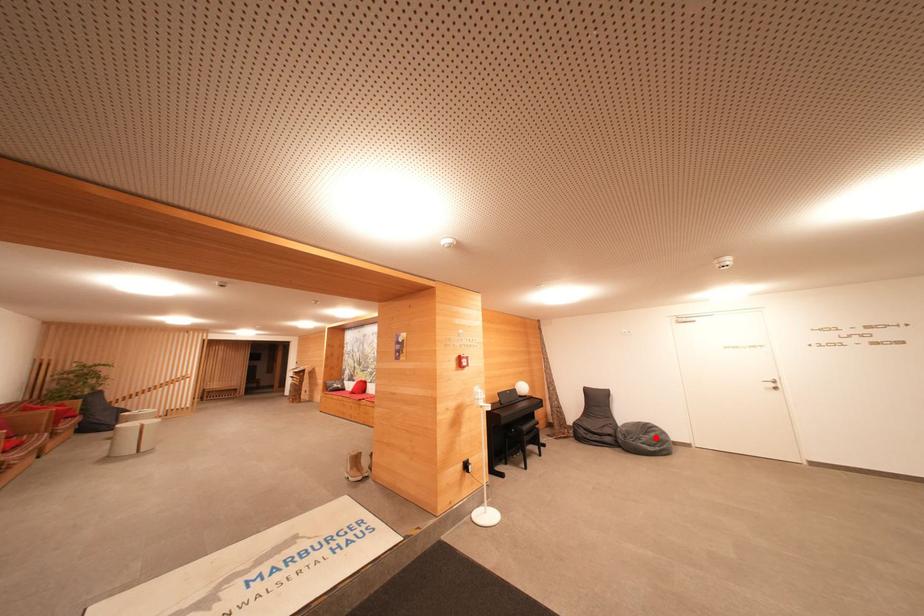
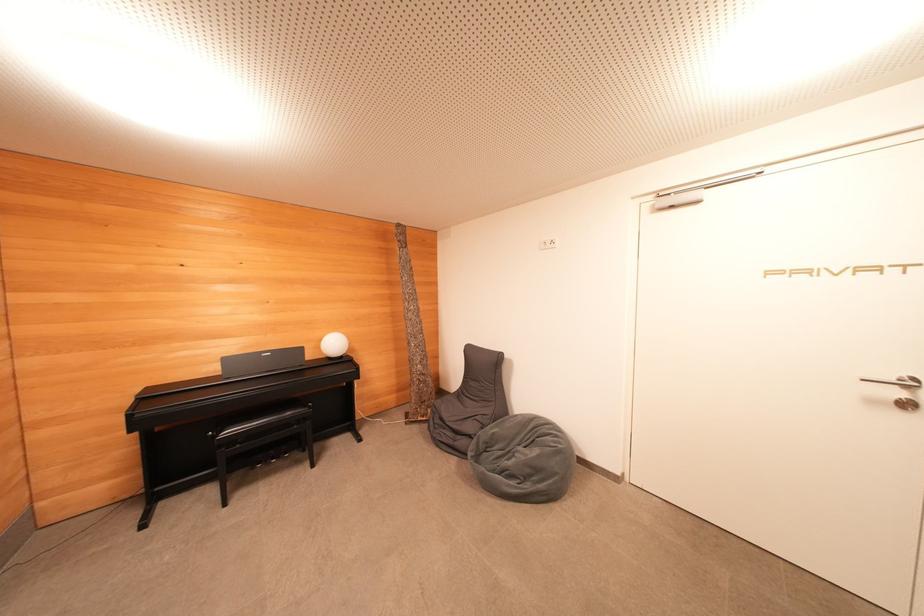
In the second image, find the point that corresponds to the highlighted location in the first image.

(540, 455)